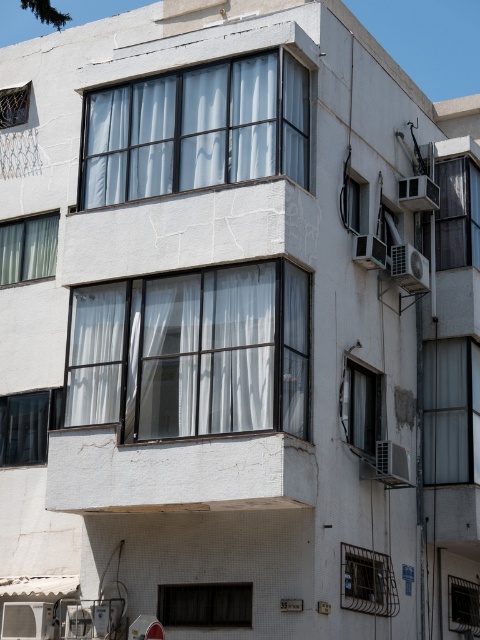
Between metallic gray window at right and black glass window at lower left, which one has less height?

Standing shorter between the two is black glass window at lower left.

Can you confirm if metallic gray window at right is taller than black glass window at lower left?

Yes, metallic gray window at right is taller than black glass window at lower left.

This screenshot has width=480, height=640. What are the coordinates of `metallic gray window at right` in the screenshot? It's located at (451, 410).

The image size is (480, 640). What are the coordinates of `metallic gray window at right` in the screenshot? It's located at (451, 410).

Is white fabric curtain at upper center positioned in front of clear glass window at upper right?

Yes, white fabric curtain at upper center is closer to the viewer.

Does white fabric curtain at upper center appear on the left side of clear glass window at upper right?

Indeed, white fabric curtain at upper center is positioned on the left side of clear glass window at upper right.

Find the location of a particular element. white fabric curtain at upper center is located at coordinates (196, 129).

Which is more to the right, metallic wire basket at lower right or white matte window at center-right?

white matte window at center-right is more to the right.

Which is in front, point (361, 600) or point (364, 404)?

Point (361, 600) is more forward.

The height and width of the screenshot is (640, 480). Find the location of `metallic wire basket at lower right`. metallic wire basket at lower right is located at coordinates (368, 580).